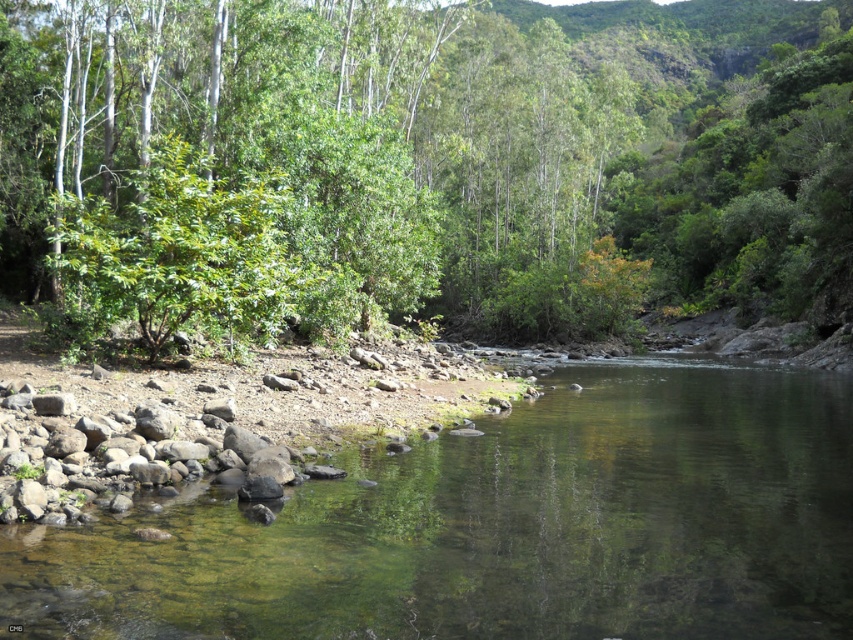
You are a hiker who wants to take a photo of the green leafy tree at upper center and the clear water at river center. Which object should you focus on first if you want to capture both in one shot without adjusting your camera settings?

You should focus on the green leafy tree at upper center first because it is larger than the clear water at river center, so capturing its details will ensure the clear water at river center is also in focus.

You are a hiker standing at the riverbank and want to take a photo of the green leafy tree at upper center and the clear water at river center. Which object will appear taller in the photo?

The green leafy tree at upper center will appear taller in the photo because it has a greater height compared to the clear water at river center.